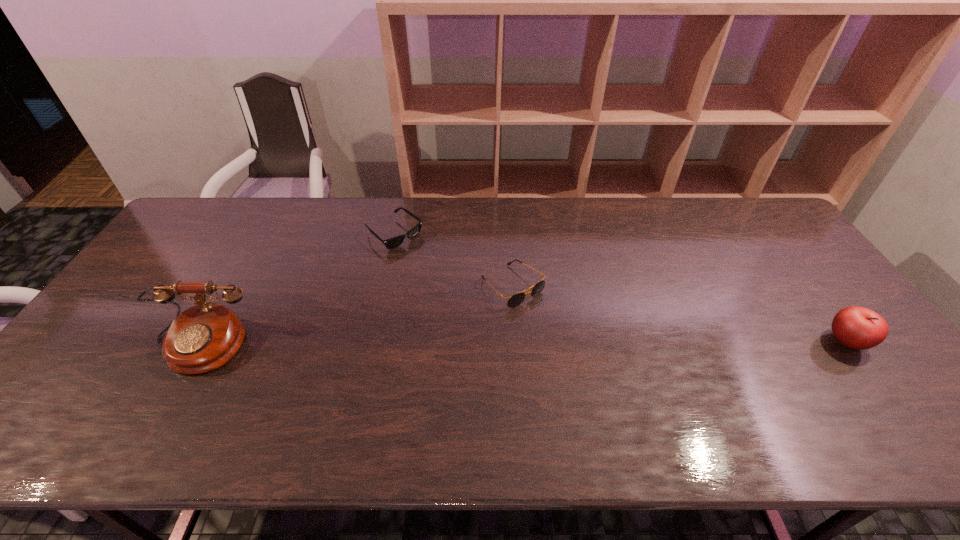
Identify the location of object present at the near left corner. This screenshot has height=540, width=960. (204, 337).

The width and height of the screenshot is (960, 540). Find the location of `free region at the far edge of the desktop`. free region at the far edge of the desktop is located at coordinates (591, 216).

Locate an element on the screen. The width and height of the screenshot is (960, 540). free location at the near edge of the desktop is located at coordinates (774, 397).

This screenshot has height=540, width=960. In order to click on vacant space at the left edge in this screenshot , I will do `click(197, 272)`.

The image size is (960, 540). In order to click on free location at the right edge in this screenshot , I will do `click(853, 361)`.

Identify the location of vacant area that lies between the farther sunglasses and the second farthest object. The image size is (960, 540). (453, 260).

Identify the location of free space that is in between the apple and the farther sunglasses. (620, 288).

At what (x,y) coordinates should I click in order to perform the action: click on free space that is in between the nearer sunglasses and the farther sunglasses. Please return your answer as a coordinate pair (x, y). Looking at the image, I should click on (453, 260).

In order to click on vacant area between the second farthest object and the left sunglasses in this screenshot , I will do `click(453, 260)`.

You are a GUI agent. You are given a task and a screenshot of the screen. Output one action in this format:
    pyautogui.click(x=<x>, y=<y>)
    Task: Click on the free spot between the third object from right to left and the leftmost object
    This screenshot has width=960, height=540.
    Given the screenshot: What is the action you would take?
    click(x=297, y=289)